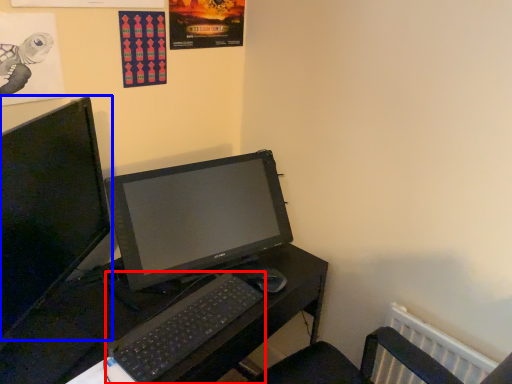
Question: Which object is further to the camera taking this photo, computer keyboard (highlighted by a red box) or computer monitor (highlighted by a blue box)?

Choices:
 (A) computer keyboard
 (B) computer monitor

Answer: (A)